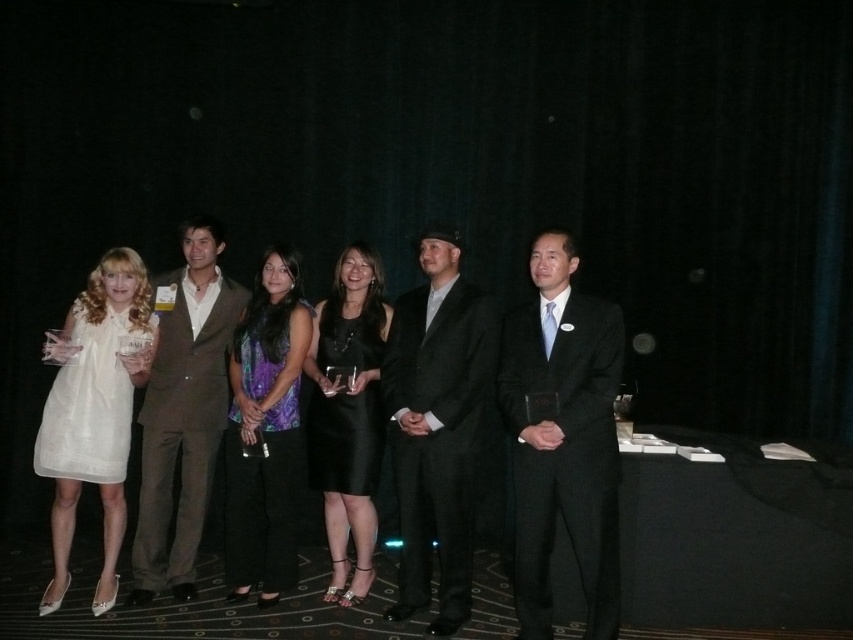
You are a photographer positioned behind the group. You need to adjust your camera to ensure both the black suit at center and the brown wool suit at center are in focus. Which suit should you focus on first to account for their heights?

The black suit at center is not as tall as brown wool suit at center, so you should focus on the brown wool suit at center first since it is taller and requires adjusting the focus to capture its full height properly.

You are a photographer at the event and need to adjust the camera focus so that both the brown wool suit at center and the white lace dress at left are in focus. Given that the depth of field can only cover a height difference of 10 cm, will this be possible?

The brown wool suit at center is taller than white lace dress at left. The height difference is not specified, but since the depth of field can cover up to 10 cm, it is possible if the difference is within that range. However, without exact measurements, we cannot confirm for certain.

You are a photographer adjusting your camera settings to focus on two specific points in the image. The first point is at coordinates point [55,504] and the second is at point [311,406]. Which point should you focus on first to ensure proper depth of field?

You should focus on point [55,504] first because it is closer to the camera than point [311,406], ensuring the depth of field captures both points effectively.